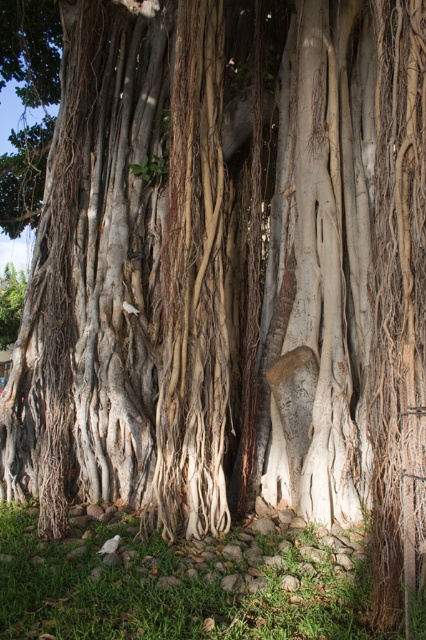
You are an ornithologist observing the tree and its roots. You notice two sections of bark on the tree trunk. One is labeled as white textured bark at center and the other as white rough bark at center. Which section of bark is positioned closer to you?

The white textured bark at center is closer to the viewer than the white rough bark at center.

You are an ornithologist observing the tree and notice two sections of bark on the tree trunk. One is labeled as white textured bark at center and the other as white rough bark at center. Which section of bark is located more to the left?

The white textured bark at center is positioned more to the left side compared to the white rough bark at center.

In the scene shown: You are an ornithologist observing the ancient tree. You notice two sections of bark on the tree trunk labeled as white textured bark at center and white rough bark at center. Which section extends higher up the trunk?

The white textured bark at center extends higher up the trunk than the white rough bark at center.